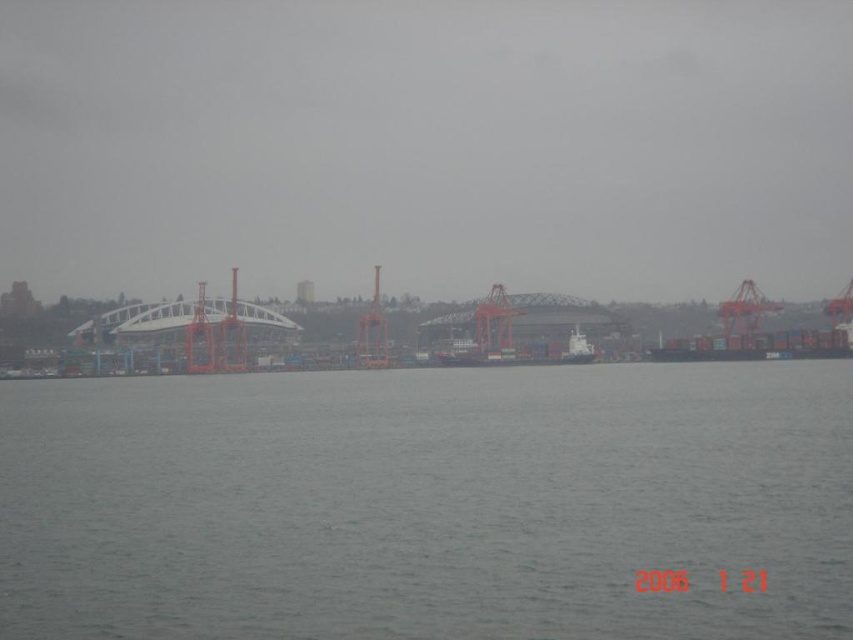
Based on the photo, you are standing at the camera position and want to throw a small floating toy to the gray water at center. Can you reach it with a throw? Assume your maximum throwing distance is 100 feet.

The gray water at center is 459.66 feet away from the camera, which is much farther than your maximum throwing distance of 100 feet. You cannot reach it with a throw.